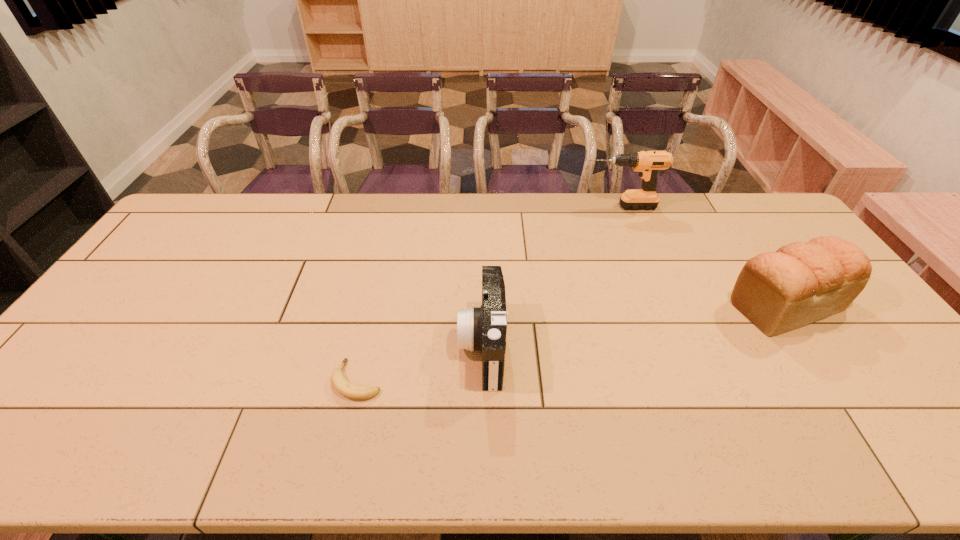
This screenshot has height=540, width=960. Find the location of `the second object from right to left`. the second object from right to left is located at coordinates (648, 163).

Identify the location of the farthest object. The height and width of the screenshot is (540, 960). (648, 163).

The image size is (960, 540). Identify the location of bread. (802, 282).

I want to click on camcorder, so click(x=484, y=328).

The height and width of the screenshot is (540, 960). Identify the location of the second object from left to right. (484, 328).

I want to click on banana, so click(x=339, y=382).

In order to click on the shortest object in this screenshot , I will do `click(339, 382)`.

Find the location of a particular element. This screenshot has width=960, height=540. vacant position located at the tip of the farthest object is located at coordinates (480, 207).

Locate an element on the screen. Image resolution: width=960 pixels, height=540 pixels. vacant space located 0.060m at the tip of the farthest object is located at coordinates (564, 207).

The width and height of the screenshot is (960, 540). Find the location of `free region located at the tip of the farthest object`. free region located at the tip of the farthest object is located at coordinates (515, 207).